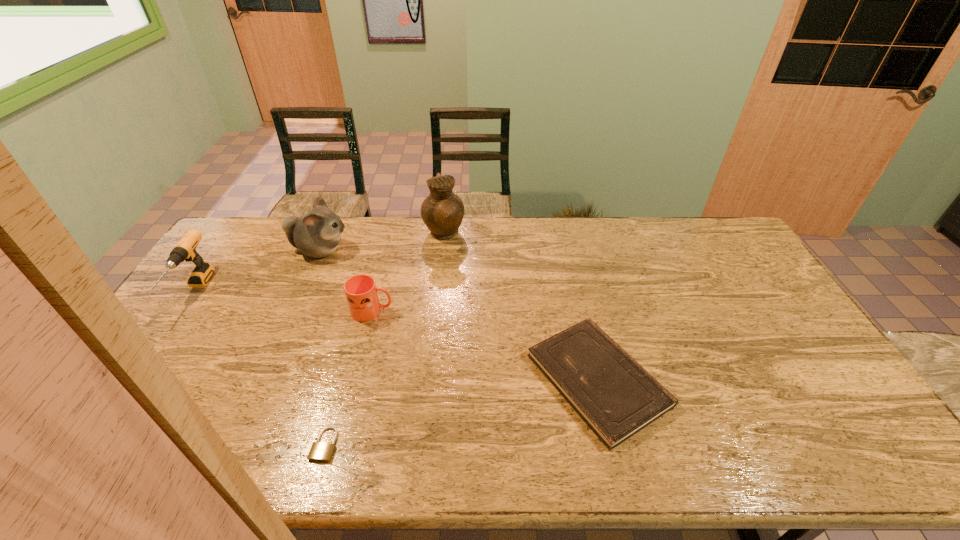
This screenshot has width=960, height=540. What are the coordinates of `the second object from right to left` in the screenshot? It's located at (442, 212).

Identify the location of the tallest object. (442, 212).

At what (x,y) coordinates should I click in order to perform the action: click on the fifth shortest object. Please return your answer as a coordinate pair (x, y). This screenshot has width=960, height=540. Looking at the image, I should click on (317, 233).

The height and width of the screenshot is (540, 960). Find the location of `the second object from left to right`. the second object from left to right is located at coordinates (317, 233).

Locate an element on the screen. the third tallest object is located at coordinates (185, 249).

Locate an element on the screen. This screenshot has width=960, height=540. drill is located at coordinates (185, 249).

At what (x,y) coordinates should I click in order to perform the action: click on the third shortest object. Please return your answer as a coordinate pair (x, y). Looking at the image, I should click on (361, 293).

The height and width of the screenshot is (540, 960). What are the coordinates of `paperback book` in the screenshot? It's located at (616, 397).

Where is `the second shortest object`? The width and height of the screenshot is (960, 540). the second shortest object is located at coordinates (616, 397).

I want to click on the shortest object, so click(x=320, y=451).